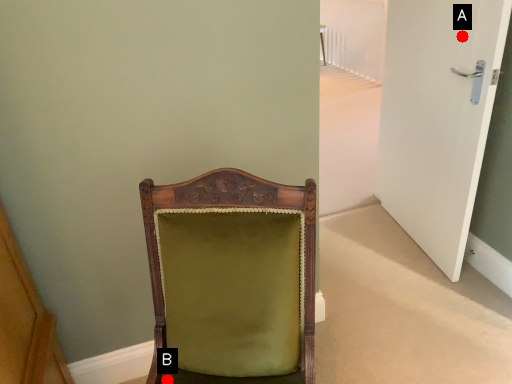
Question: Two points are circled on the image, labeled by A and B beside each circle. Which point appears closest to the camera in this image?

Choices:
 (A) A is closer
 (B) B is closer

Answer: (B)